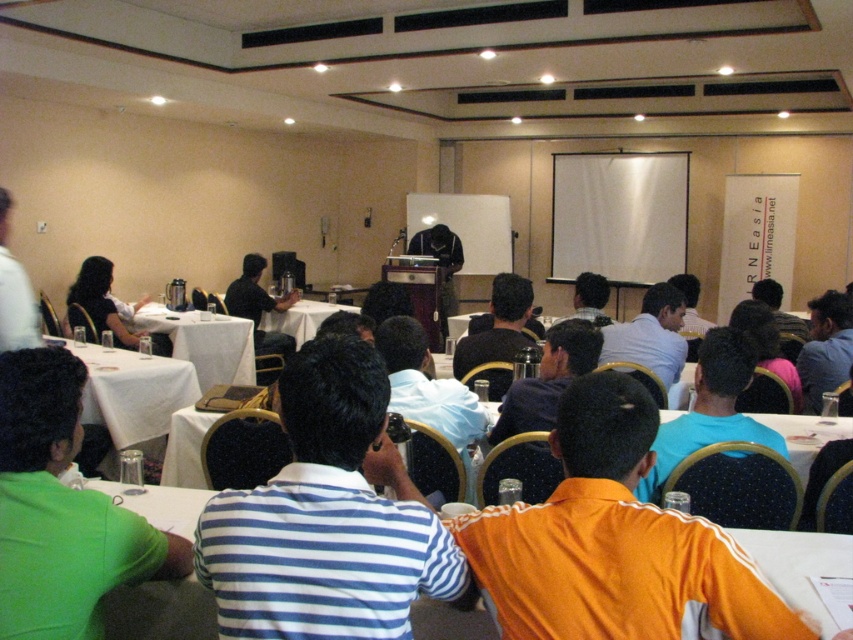
Does blue striped shirt at center have a greater width compared to white plastic table at center?

In fact, blue striped shirt at center might be narrower than white plastic table at center.

Does blue striped shirt at center appear on the left side of white plastic table at center?

No, blue striped shirt at center is not to the left of white plastic table at center.

Find the location of a particular element. This screenshot has width=853, height=640. blue striped shirt at center is located at coordinates (328, 516).

Is blue striped shirt at center below white shirt at upper left?

Correct, blue striped shirt at center is located below white shirt at upper left.

Who is lower down, blue striped shirt at center or white shirt at upper left?

blue striped shirt at center

Is point (367, 355) more distant than point (30, 308)?

No, it is not.

Where is `blue striped shirt at center`? This screenshot has height=640, width=853. blue striped shirt at center is located at coordinates (328, 516).

Which of these two, white plastic table at center or blue fabric shirt at center, stands taller?

blue fabric shirt at center is taller.

Does point (196, 508) come closer to viewer compared to point (721, 419)?

Yes, it is.

Is point (830, 634) behind point (706, 403)?

No, it is in front of (706, 403).

You are a GUI agent. You are given a task and a screenshot of the screen. Output one action in this format:
    pyautogui.click(x=<x>, y=<y>)
    Task: Click on the white plastic table at center
    Image resolution: width=853 pixels, height=640 pixels.
    Given the screenshot: What is the action you would take?
    pyautogui.click(x=799, y=564)